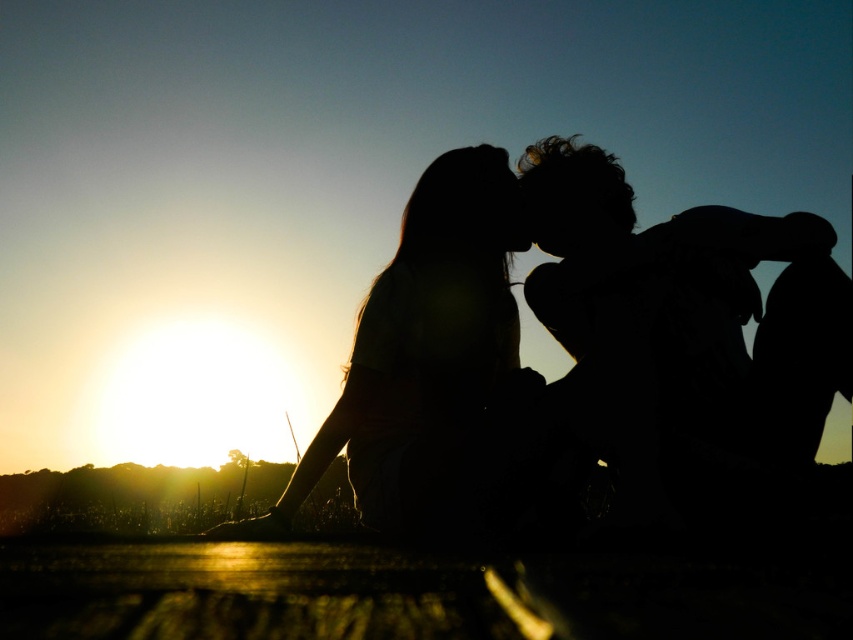
You are a photographer trying to capture the sunset scene. You notice two points in the image at coordinates point (819, 385) and point (445, 376). Which point is closer to your camera lens?

Point (819, 385) is closer to the camera lens than point (445, 376).

Looking at this image, you are a photographer capturing this sunset scene. You notice two silhouette hairs in the image. Which silhouette hair, the silhouette hair at right or the silhouette hair at center, is positioned closer to the camera?

The silhouette hair at right is closer to the viewer than the silhouette hair at center, so the silhouette hair at right is positioned closer to the camera.

You are a photographer who wants to capture the sunset scene with the two silhouettes. You have a camera that can only focus on one of the silhouette hair at right or silhouette hair at center. Which one should you choose to ensure the thicker hair is in focus?

The silhouette hair at center is thicker than the silhouette hair at right, so you should focus on the silhouette hair at center to ensure the thicker hair is in focus.